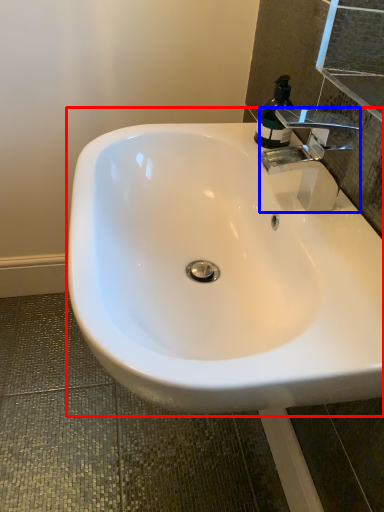
Question: Among these objects, which one is nearest to the camera, sink (highlighted by a red box) or tap (highlighted by a blue box)?

Choices:
 (A) sink
 (B) tap

Answer: (A)